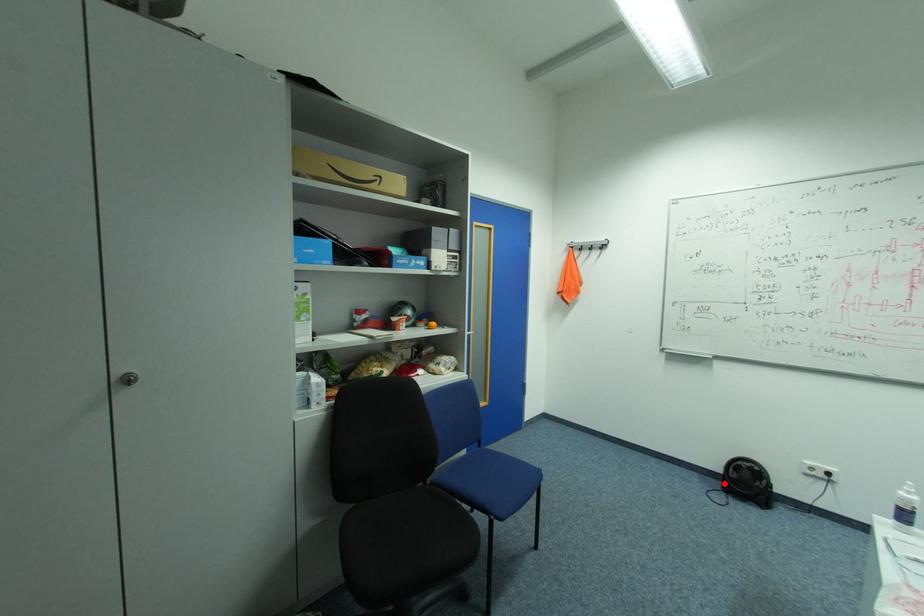
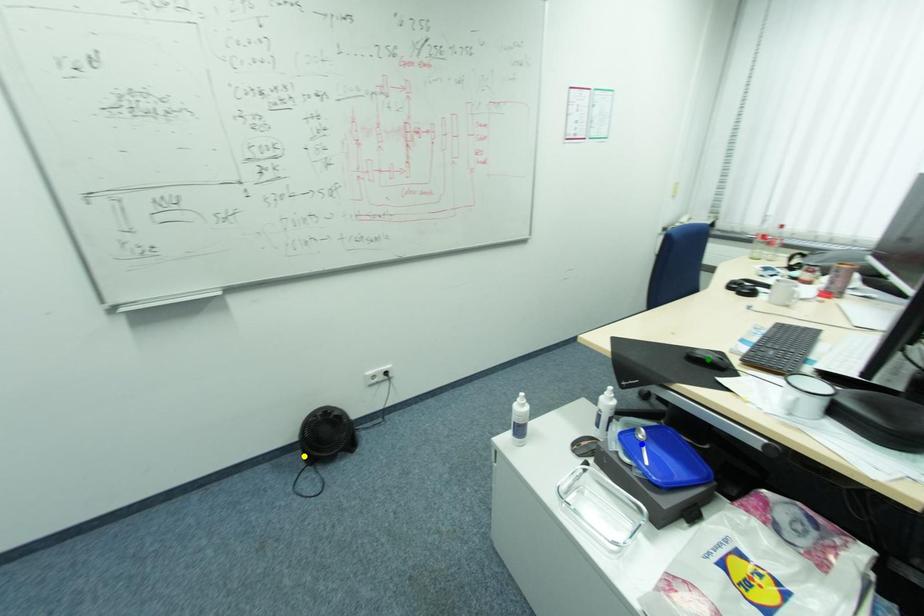
Question: I am providing you with two images of the same scene from different viewpoints. A red point is marked on the first image. You are given multiple points on the second image. Which spot in image 2 lines up with the point in image 1?

Choices:
 (A) green point
 (B) yellow point
 (C) blue point

Answer: (B)